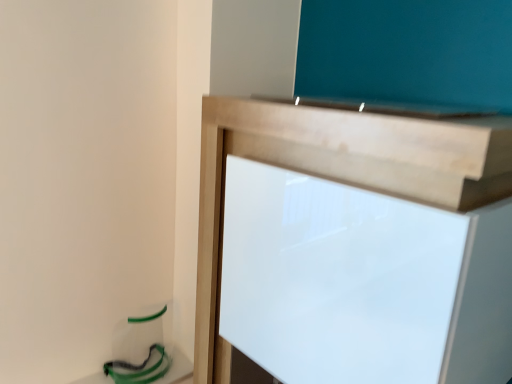
The image size is (512, 384). I want to click on white glossy board at center, so click(x=311, y=172).

What do you see at coordinates (311, 172) in the screenshot? Image resolution: width=512 pixels, height=384 pixels. I see `white glossy board at center` at bounding box center [311, 172].

In order to click on white glossy board at center in this screenshot , I will do `click(311, 172)`.